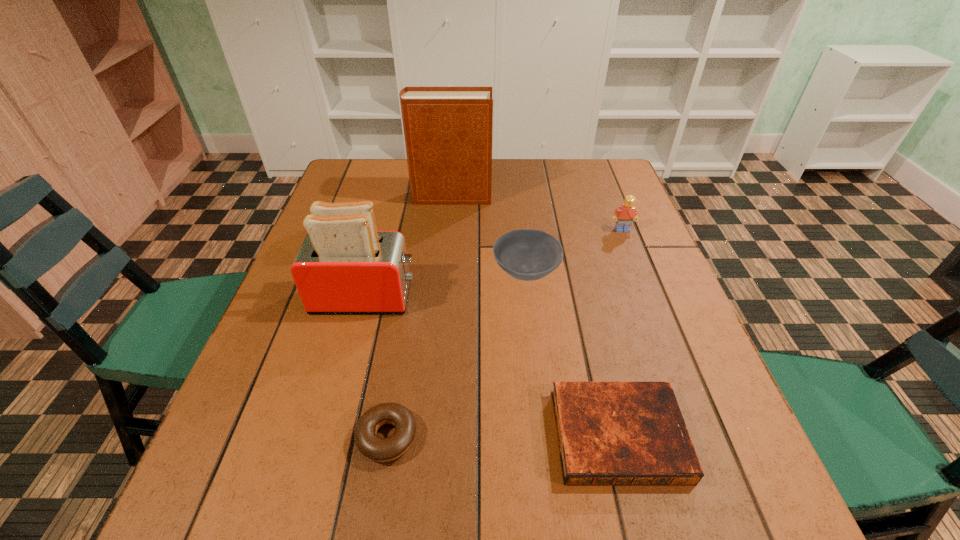
This screenshot has width=960, height=540. In order to click on free location that satisfies the following two spatial constraints: 1. on the front-facing side of the doughnut; 2. on the left side of the toaster in this screenshot , I will do (x=327, y=437).

You are a GUI agent. You are given a task and a screenshot of the screen. Output one action in this format:
    pyautogui.click(x=<x>, y=<y>)
    Task: Click on the blank area in the image that satisfies the following two spatial constraints: 1. on the back side of the bowl; 2. on the open cover of the tallest object
    Image resolution: width=960 pixels, height=540 pixels.
    Given the screenshot: What is the action you would take?
    pyautogui.click(x=517, y=197)

At what (x,y) coordinates should I click in order to perform the action: click on free space that satisfies the following two spatial constraints: 1. on the back side of the fourth tallest object; 2. on the left side of the doughnut. Please return your answer as a coordinate pair (x, y). The height and width of the screenshot is (540, 960). Looking at the image, I should click on (414, 273).